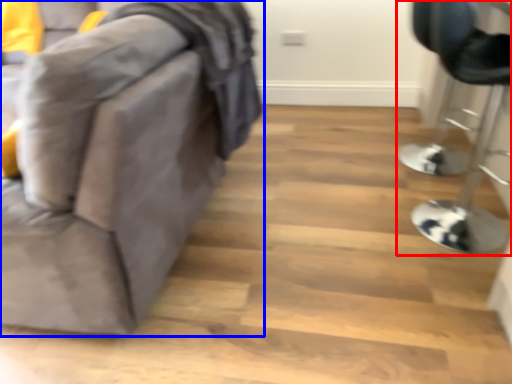
Question: Among these objects, which one is nearest to the camera, furniture (highlighted by a red box) or furniture (highlighted by a blue box)?

Choices:
 (A) furniture
 (B) furniture

Answer: (B)